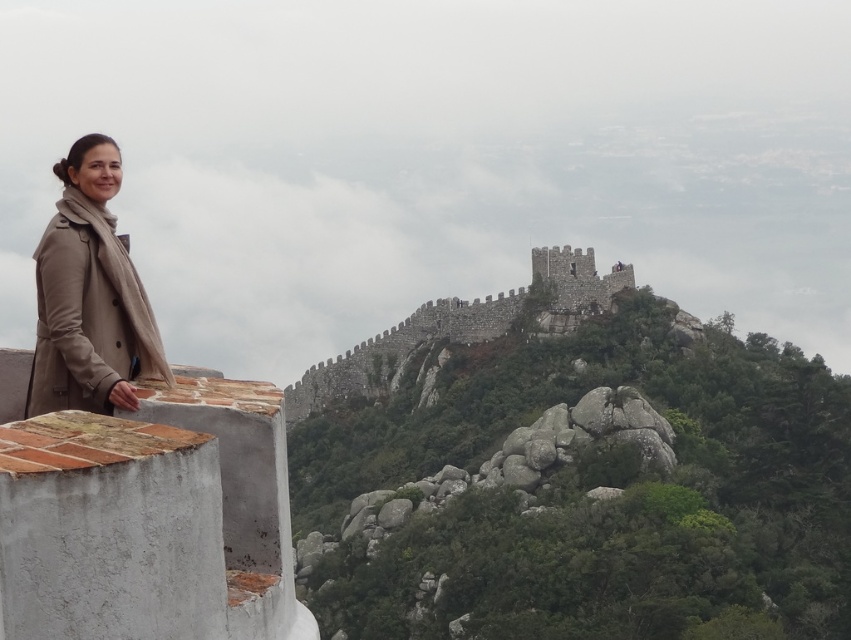
Can you confirm if beige coat at left is taller than stone wall at upper center?

No.

Which is in front, point (71, 280) or point (427, 316)?

Positioned in front is point (71, 280).

Measure the distance between point (x=66, y=346) and camera.

Point (x=66, y=346) is 69.90 meters from camera.

At what (x,y) coordinates should I click in order to perform the action: click on beige coat at left. Please return your answer as a coordinate pair (x, y). Image resolution: width=851 pixels, height=640 pixels. Looking at the image, I should click on (89, 296).